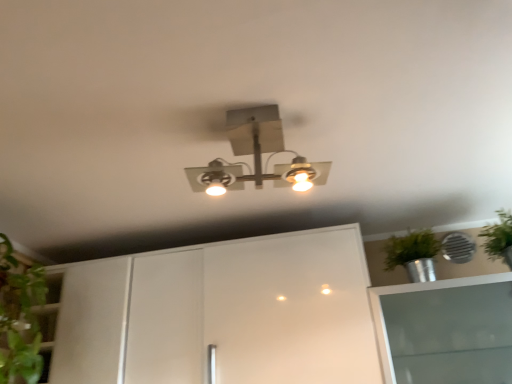
What do you see at coordinates (257, 156) in the screenshot?
I see `metallic silver light fixture at center` at bounding box center [257, 156].

Locate an element on the screen. Image resolution: width=512 pixels, height=384 pixels. metallic silver light fixture at center is located at coordinates (257, 156).

What are the coordinates of `metallic silver light fixture at center` in the screenshot? It's located at (257, 156).